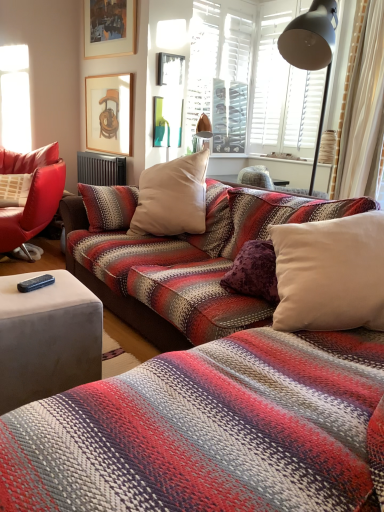
Question: From a real-world perspective, is dark gray metallic radiator at center positioned above or below velvet gray studio couch at lower left?

Choices:
 (A) below
 (B) above

Answer: (B)

Question: Looking at the image, does dark gray metallic radiator at center seem bigger or smaller compared to velvet gray studio couch at lower left?

Choices:
 (A) small
 (B) big

Answer: (A)

Question: Based on their relative distances, which object is farther from the matte black picture frame at upper center, the second picture frame in the bottom-to-top sequence?

Choices:
 (A) wooden framed picture at upper left, the first picture frame in the bottom-to-top sequence
 (B) black rubber remote control at lower left
 (C) dark gray metallic radiator at center
 (D) wooden picture frame at upper center, marked as the 3th picture frame in a bottom-to-top arrangement
 (E) velvet gray studio couch at lower left

Answer: (E)

Question: Which is nearer to the matte black picture frame at upper center, which appears as the 2th picture frame when viewed from the top?

Choices:
 (A) dark gray metallic radiator at center
 (B) velvet gray studio couch at lower left
 (C) wooden framed picture at upper left, the 3th picture frame in the top-to-bottom sequence
 (D) black rubber remote control at lower left
 (E) wooden picture frame at upper center, marked as the 3th picture frame in a bottom-to-top arrangement

Answer: (C)